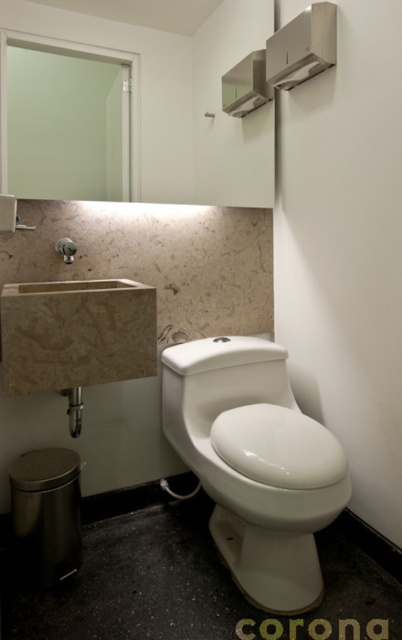
Can you confirm if green matte mirror at upper left is bigger than brushed metal faucet at left?

Yes, green matte mirror at upper left is bigger than brushed metal faucet at left.

Does green matte mirror at upper left have a greater height compared to brushed metal faucet at left?

Correct, green matte mirror at upper left is much taller as brushed metal faucet at left.

This screenshot has width=402, height=640. Identify the location of green matte mirror at upper left. (67, 122).

Between white glossy toilet at center and green matte mirror at upper left, which one is positioned higher?

green matte mirror at upper left is higher up.

Can you confirm if white glossy toilet at center is positioned to the left of green matte mirror at upper left?

In fact, white glossy toilet at center is to the right of green matte mirror at upper left.

You are a GUI agent. You are given a task and a screenshot of the screen. Output one action in this format:
    pyautogui.click(x=<x>, y=<y>)
    Task: Click on the white glossy toilet at center
    This screenshot has width=402, height=640.
    Given the screenshot: What is the action you would take?
    pyautogui.click(x=254, y=464)

Who is more forward, (x=162, y=44) or (x=67, y=243)?

Point (x=67, y=243) is more forward.

This screenshot has width=402, height=640. I want to click on white glossy mirror at upper center, so click(x=180, y=99).